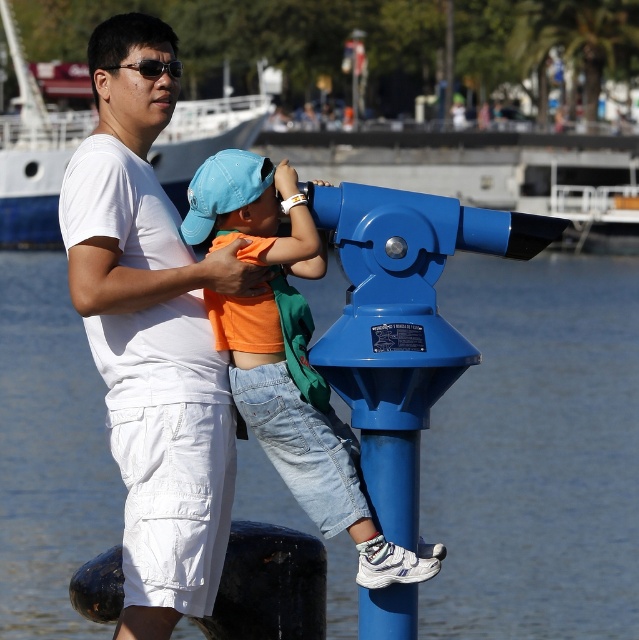
Does orange cotton shirt at upper center come in front of matte black sunglasses at upper left?

Yes, orange cotton shirt at upper center is closer to the viewer.

Is the position of orange cotton shirt at upper center more distant than that of matte black sunglasses at upper left?

No.

Is point (212, 225) closer to viewer compared to point (151, 60)?

Yes.

The width and height of the screenshot is (639, 640). What are the coordinates of `orange cotton shirt at upper center` in the screenshot? It's located at (304, 426).

Who is higher up, blue plastic water at lower center or orange cotton shirt at upper center?

orange cotton shirt at upper center is above.

Image resolution: width=639 pixels, height=640 pixels. Describe the element at coordinates (535, 452) in the screenshot. I see `blue plastic water at lower center` at that location.

Describe the element at coordinates (535, 452) in the screenshot. I see `blue plastic water at lower center` at that location.

Where is `blue plastic water at lower center`? Image resolution: width=639 pixels, height=640 pixels. blue plastic water at lower center is located at coordinates (535, 452).

Can you confirm if blue plastic water at lower center is positioned below white cotton shirt at upper left?

Yes.

Is blue plastic water at lower center wider than white cotton shirt at upper left?

Correct, the width of blue plastic water at lower center exceeds that of white cotton shirt at upper left.

Locate an element on the screen. The height and width of the screenshot is (640, 639). blue plastic water at lower center is located at coordinates (535, 452).

Identify the location of blue plastic water at lower center. (535, 452).